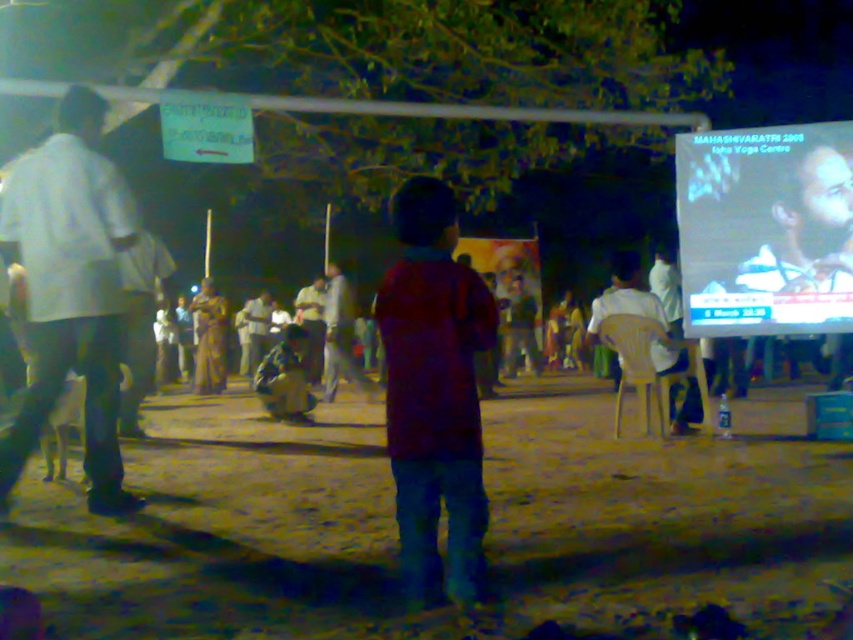
Question: Which point is closer to the camera?

Choices:
 (A) white cotton shirt at left
 (B) dark red jacket at center

Answer: (B)

Question: Is white cotton shirt at left bigger than white plastic chair at center?

Choices:
 (A) no
 (B) yes

Answer: (B)

Question: Which point appears closest to the camera in this image?

Choices:
 (A) (97, 376)
 (B) (352, 333)

Answer: (A)

Question: Which point is closer to the camera?

Choices:
 (A) brown sandy ground at center
 (B) white plastic chair at center

Answer: (A)

Question: Does brown sandy ground at center have a smaller size compared to white cotton shirt at left?

Choices:
 (A) no
 (B) yes

Answer: (B)

Question: Can you confirm if brown sandy ground at center is positioned below dark red jacket at center?

Choices:
 (A) yes
 (B) no

Answer: (A)